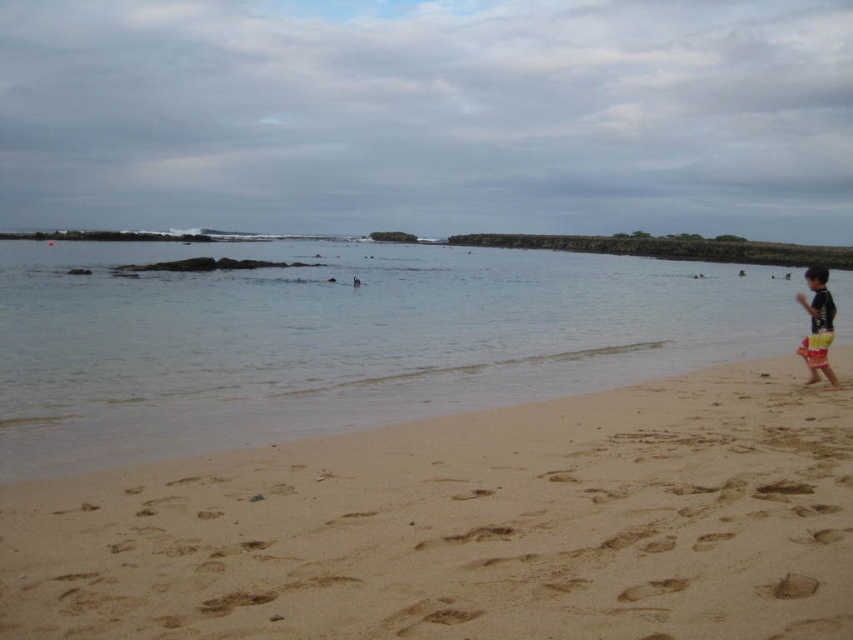
Question: Which of these objects is positioned closest to the black matte swimsuit at right?

Choices:
 (A) light brown sandy beach at lower right
 (B) clear water at beach right

Answer: (A)

Question: Can you confirm if clear water at beach right is positioned below black matte swimsuit at right?

Choices:
 (A) no
 (B) yes

Answer: (A)

Question: Is light brown sandy beach at lower right below black matte swimsuit at right?

Choices:
 (A) yes
 (B) no

Answer: (A)

Question: Does light brown sandy beach at lower right appear under black matte swimsuit at right?

Choices:
 (A) no
 (B) yes

Answer: (B)

Question: Which of these objects is positioned farthest from the clear water at beach right?

Choices:
 (A) black matte swimsuit at right
 (B) light brown sandy beach at lower right

Answer: (B)

Question: Which point is farther from the camera taking this photo?

Choices:
 (A) (544, 522)
 (B) (822, 310)
 (C) (251, 435)

Answer: (B)